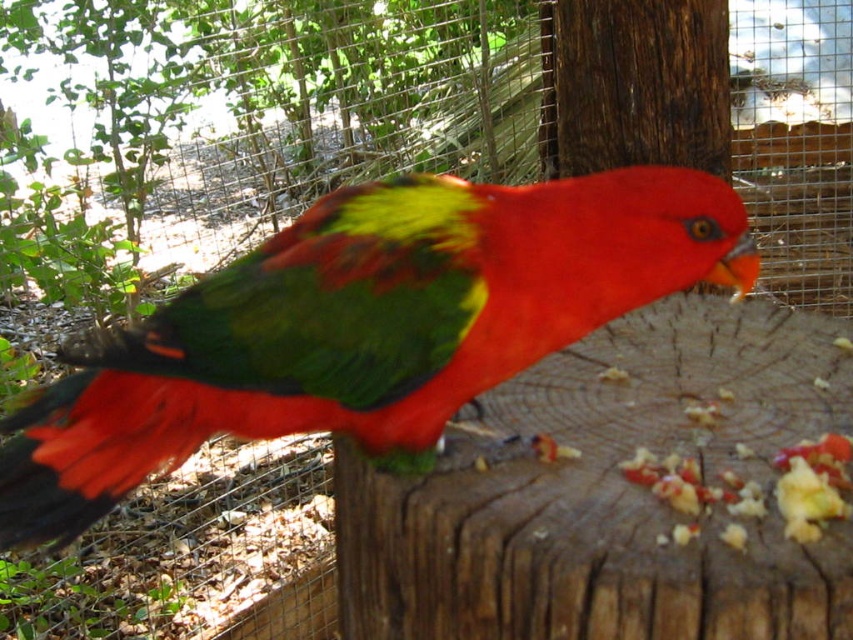
Question: Which object is farther from the camera taking this photo?

Choices:
 (A) brown rough tree trunk at center
 (B) shiny green parrot at center

Answer: (A)

Question: Which object is farther from the camera taking this photo?

Choices:
 (A) brown rough tree trunk at center
 (B) shiny green parrot at center

Answer: (A)

Question: Does shiny green parrot at center appear on the right side of brown rough tree trunk at center?

Choices:
 (A) yes
 (B) no

Answer: (B)

Question: Can you confirm if shiny green parrot at center is positioned to the right of brown rough tree trunk at center?

Choices:
 (A) no
 (B) yes

Answer: (A)

Question: Can you confirm if shiny green parrot at center is wider than brown rough tree trunk at center?

Choices:
 (A) yes
 (B) no

Answer: (A)

Question: Which object is farther from the camera taking this photo?

Choices:
 (A) brown rough tree trunk at center
 (B) shiny green parrot at center

Answer: (A)